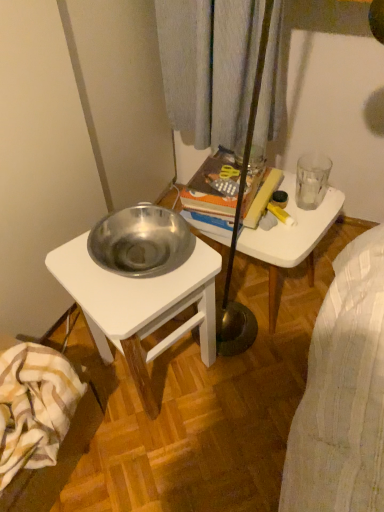
Question: Can you confirm if transparent glass at upper right is taller than white glossy table at upper center?

Choices:
 (A) yes
 (B) no

Answer: (B)

Question: Is the position of transparent glass at upper right more distant than that of white glossy table at upper center?

Choices:
 (A) no
 (B) yes

Answer: (B)

Question: Does transparent glass at upper right have a lesser height compared to white glossy table at upper center?

Choices:
 (A) no
 (B) yes

Answer: (B)

Question: Can white glossy table at upper center be found inside transparent glass at upper right?

Choices:
 (A) no
 (B) yes

Answer: (A)

Question: From the image's perspective, is transparent glass at upper right below white glossy table at upper center?

Choices:
 (A) no
 (B) yes

Answer: (A)

Question: Considering the positions of orange hardcover book at center and white glossy table at upper center in the image, is orange hardcover book at center taller or shorter than white glossy table at upper center?

Choices:
 (A) short
 (B) tall

Answer: (A)

Question: Is orange hardcover book at center wider or thinner than white glossy table at upper center?

Choices:
 (A) thin
 (B) wide

Answer: (A)

Question: Would you say orange hardcover book at center is to the left or to the right of white glossy table at upper center in the picture?

Choices:
 (A) right
 (B) left

Answer: (B)

Question: From a real-world perspective, is orange hardcover book at center above or below white glossy table at upper center?

Choices:
 (A) below
 (B) above

Answer: (B)

Question: Is striped cotton blanket at lower left in front of or behind orange hardcover book at center in the image?

Choices:
 (A) front
 (B) behind

Answer: (A)

Question: From the image's perspective, is striped cotton blanket at lower left positioned above or below orange hardcover book at center?

Choices:
 (A) below
 (B) above

Answer: (A)

Question: In terms of width, does striped cotton blanket at lower left look wider or thinner when compared to orange hardcover book at center?

Choices:
 (A) thin
 (B) wide

Answer: (A)

Question: Visually, is striped cotton blanket at lower left positioned to the left or to the right of orange hardcover book at center?

Choices:
 (A) left
 (B) right

Answer: (A)

Question: Looking at the image, does transparent glass at upper right seem bigger or smaller compared to striped cotton blanket at lower left?

Choices:
 (A) big
 (B) small

Answer: (B)

Question: Which is correct: transparent glass at upper right is inside striped cotton blanket at lower left, or outside of it?

Choices:
 (A) outside
 (B) inside

Answer: (A)